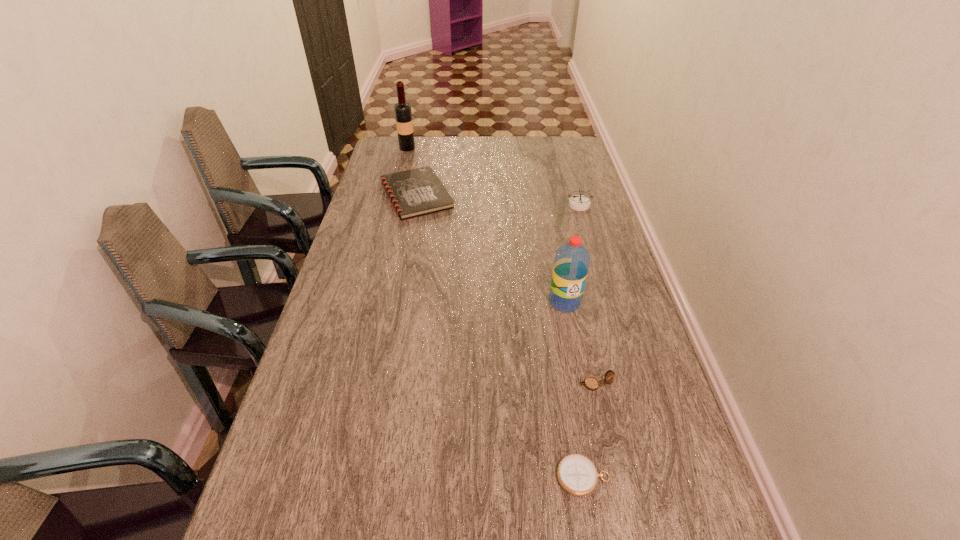
This screenshot has width=960, height=540. Identify the location of the tallest object. (403, 114).

Where is `the farthest object`? the farthest object is located at coordinates (403, 114).

Image resolution: width=960 pixels, height=540 pixels. In order to click on the fifth shortest object in this screenshot , I will do `click(571, 264)`.

Identify the location of the third nearest object. (571, 264).

Where is `the farthest compass`? The width and height of the screenshot is (960, 540). the farthest compass is located at coordinates (577, 202).

At what (x,y) coordinates should I click in order to perform the action: click on the third tallest object. Please return your answer as a coordinate pair (x, y). The height and width of the screenshot is (540, 960). Looking at the image, I should click on (577, 202).

This screenshot has width=960, height=540. Identify the location of the second shortest compass. coord(591,383).

The height and width of the screenshot is (540, 960). Identify the location of the second nearest object. (591, 383).

The image size is (960, 540). Find the location of `notebook`. notebook is located at coordinates (416, 192).

Where is `the nearest object`? the nearest object is located at coordinates (577, 475).